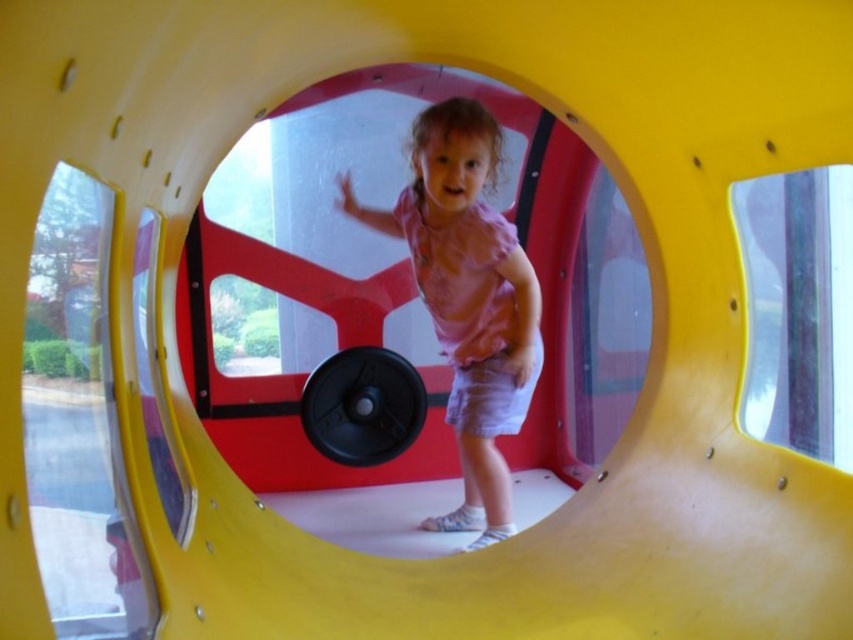
You are a parent supervising a child playing in a play structure. You notice the pink fabric dress at center and the black rubber barbell at center. Which object is nearer to you?

The pink fabric dress at center is closer to the viewer than the black rubber barbell at center.

You are a parent trying to ensure your child stays safe while playing on the play structure. The child is wearing the pink fabric dress at center and holding the black rubber barbell at center. Which item is larger in size?

The pink fabric dress at center is bigger than the black rubber barbell at center, so the dress is larger in size.

You are at the playground and want to place a sticker on the play structure. You have two points to choose from. The first point is at coordinate point (490, 289) and the second is at point (383, 401). Which point is closer to the child standing near the circular opening?

Point (490, 289) is in front of point (383, 401), so it is closer to the child standing near the circular opening.